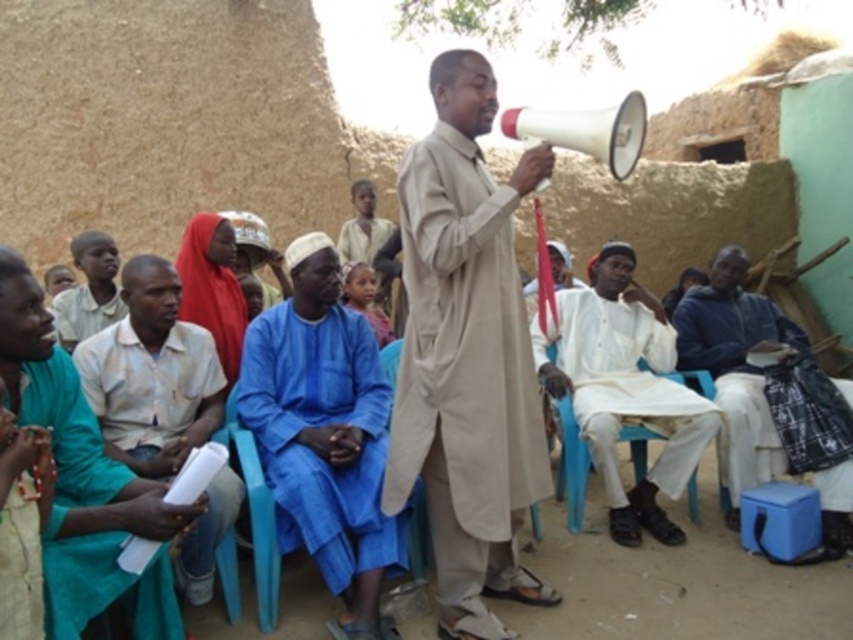
You are a photographer trying to capture a closeup of the teal fabric robe at lower left and light blue fabric at lower left. Which one will appear larger in the photo?

The teal fabric robe at lower left will appear larger in the photo because it is closer to the viewer than the light blue fabric at lower left.

You are a photographer trying to capture the scene from the back of the group. You want to ensure both the teal fabric robe at lower left and the light blue fabric at lower left are visible in the shot. Based on their positions, which one should you focus on first to frame the photo properly?

The teal fabric robe at lower left is located below the light blue fabric at lower left. To frame the photo properly, focus on the light blue fabric at lower left first since it is higher up and will be more visible in the upper part of the frame, allowing the lower teal fabric robe to naturally fall into the composition below.